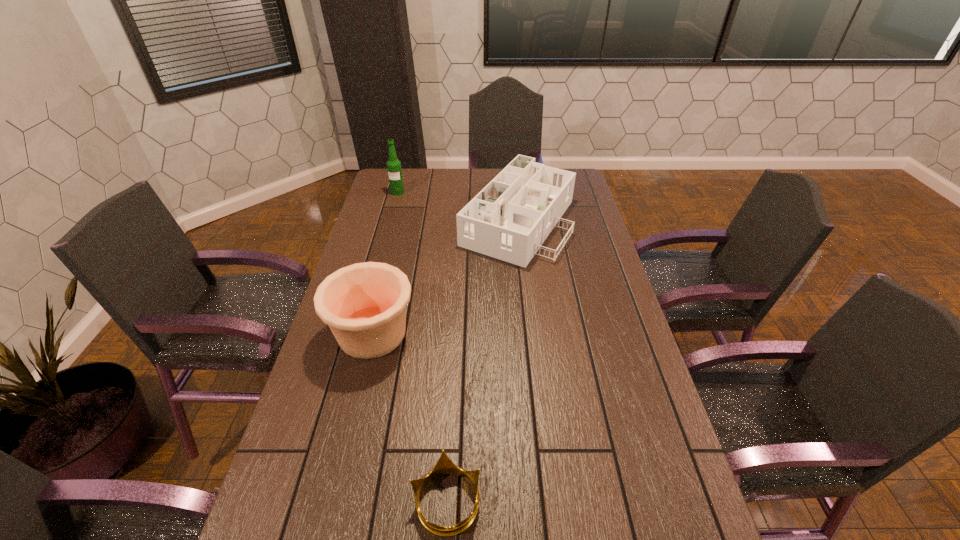
The width and height of the screenshot is (960, 540). In order to click on free area in between the second shortest object and the shortest object in this screenshot , I will do `click(482, 360)`.

Point out which object is positioned as the nearest to the tallest object. Please provide its 2D coordinates. Your answer should be formatted as a tuple, i.e. [(x, y)], where the tuple contains the x and y coordinates of a point satisfying the conditions above.

[(509, 219)]

Select which object appears as the third closest to the second shortest object. Please provide its 2D coordinates. Your answer should be formatted as a tuple, i.e. [(x, y)], where the tuple contains the x and y coordinates of a point satisfying the conditions above.

[(444, 466)]

Identify the location of vacant space that satisfies the following two spatial constraints: 1. on the front side of the nearest object; 2. on the left side of the pottery. The width and height of the screenshot is (960, 540). (331, 501).

This screenshot has height=540, width=960. Identify the location of free spot that satisfies the following two spatial constraints: 1. on the label of the dollhouse; 2. on the right side of the beer bottle. (390, 220).

Identify the location of vacant region that satisfies the following two spatial constraints: 1. on the front side of the shortest object; 2. on the left side of the second tallest object. (331, 501).

At what (x,y) coordinates should I click in order to perform the action: click on vacant region that satisfies the following two spatial constraints: 1. on the label of the tallest object; 2. on the left side of the third shortest object. Please return your answer as a coordinate pair (x, y). Looking at the image, I should click on (359, 333).

Find the location of a particular element. free space that satisfies the following two spatial constraints: 1. on the label of the second nearest object; 2. on the right side of the tallest object is located at coordinates (359, 333).